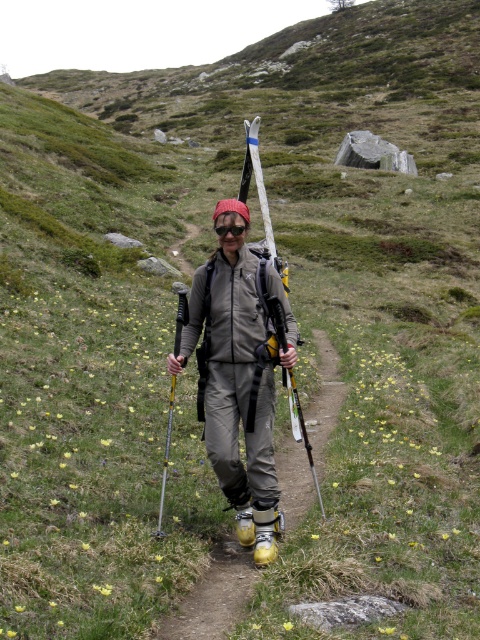
Question: Is yellow rubber boots at center to the right of transparent plastic goggles at center from the viewer's perspective?

Choices:
 (A) yes
 (B) no

Answer: (A)

Question: Can you confirm if yellow rubber boots at center is thinner than transparent plastic goggles at center?

Choices:
 (A) yes
 (B) no

Answer: (B)

Question: Which object is farther from the camera taking this photo?

Choices:
 (A) yellow metallic ski pole at center
 (B) transparent plastic goggles at center
 (C) white matte ski at center

Answer: (C)

Question: Does yellow rubber boots at center appear over yellow metallic ski pole at center?

Choices:
 (A) no
 (B) yes

Answer: (A)

Question: Which object appears closest to the camera in this image?

Choices:
 (A) white matte ski at center
 (B) transparent plastic goggles at center

Answer: (B)

Question: Which point is farther from the camera taking this photo?

Choices:
 (A) (222, 236)
 (B) (226, 563)
 (C) (259, 172)

Answer: (C)